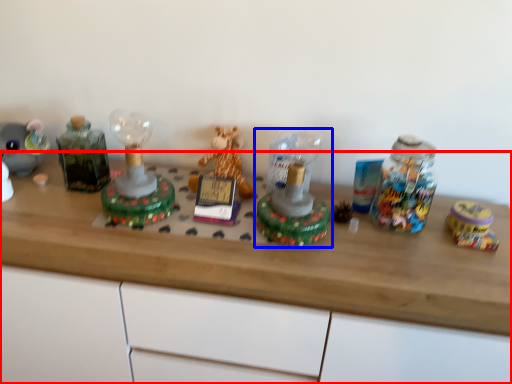
Question: Which of the following is the farthest to the observer, desk (highlighted by a red box) or toy (highlighted by a blue box)?

Choices:
 (A) desk
 (B) toy

Answer: (B)